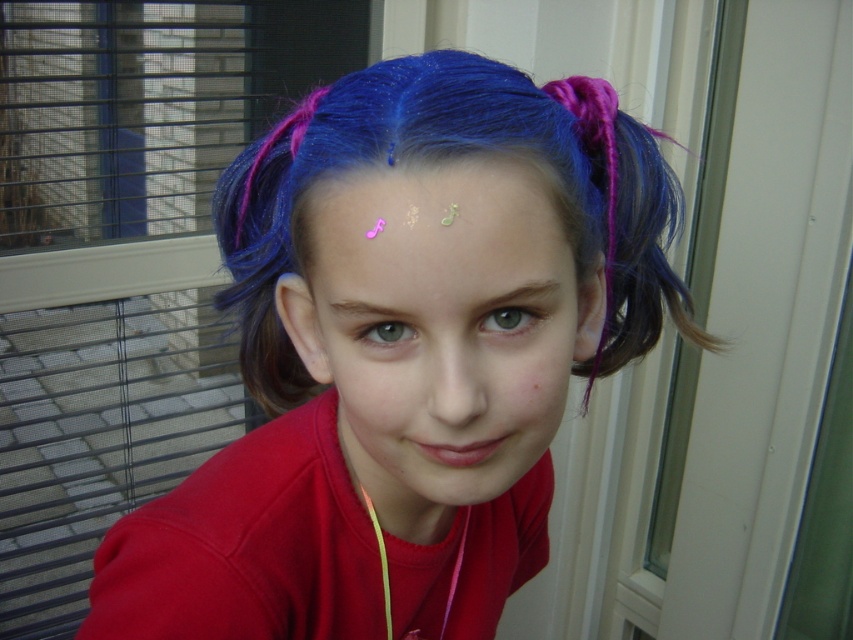
Question: Among these points, which one is nearest to the camera?

Choices:
 (A) (102, 630)
 (B) (535, 400)
 (C) (490, 301)
 (D) (363, 300)

Answer: (C)

Question: Is the position of blue shiny hair at center more distant than that of brown/skin-colored freckle at center?

Choices:
 (A) yes
 (B) no

Answer: (B)

Question: Which object is positioned farthest from the shiny glitter face at center?

Choices:
 (A) brown matte eyebrow at upper center
 (B) blue shiny hair at center

Answer: (A)

Question: Can you confirm if blue shiny hair at center is positioned below pink glitter music notes at center?

Choices:
 (A) yes
 (B) no

Answer: (A)

Question: Which object is the farthest from the blue shiny hair at center?

Choices:
 (A) pink glitter music notes at center
 (B) brown smooth eyebrow at upper center
 (C) brown matte eyebrow at upper center

Answer: (C)

Question: Is the position of pink glitter music notes at center less distant than that of brown/skin-colored freckle at center?

Choices:
 (A) yes
 (B) no

Answer: (A)